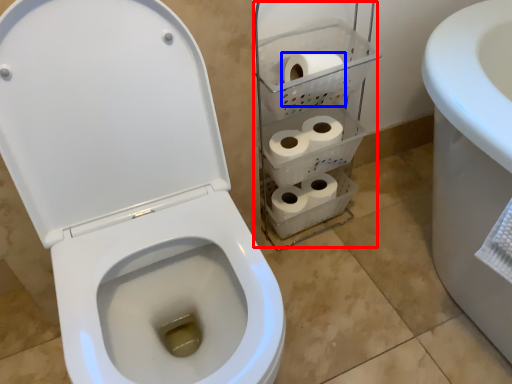
Question: Which object is closer to the camera taking this photo, shelf (highlighted by a red box) or to paper (highlighted by a blue box)?

Choices:
 (A) shelf
 (B) to paper

Answer: (A)